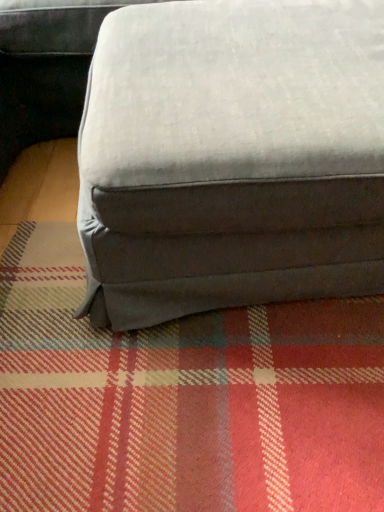
Question: Should I look upward or downward to see textured gray fabric ottoman at center?

Choices:
 (A) up
 (B) down

Answer: (A)